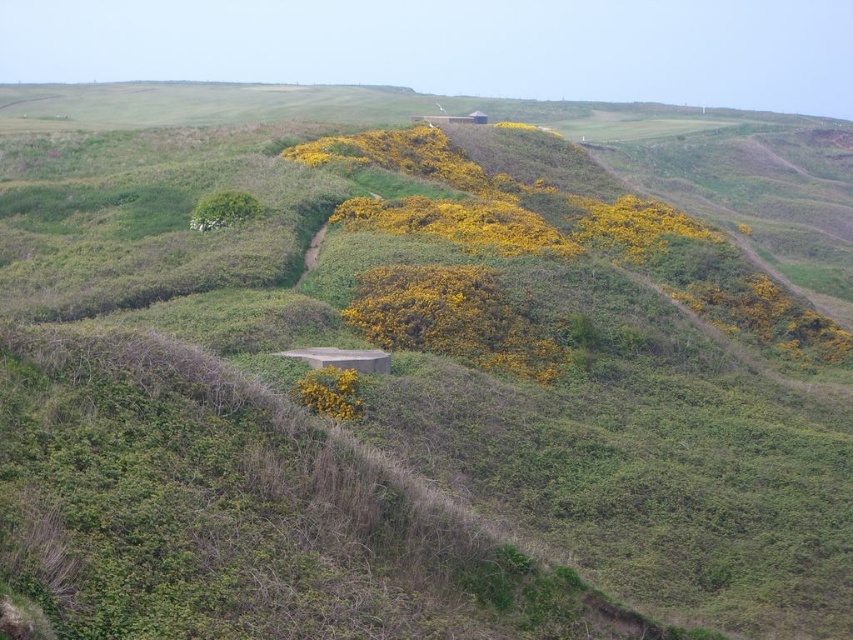
Question: Which of these objects is positioned farthest from the yellow-green foliage at center?

Choices:
 (A) yellow matte flower at center
 (B) yellow matte flowers at center

Answer: (A)

Question: Does yellow-green foliage at center appear on the left side of yellow matte flowers at center?

Choices:
 (A) yes
 (B) no

Answer: (B)

Question: Among these objects, which one is nearest to the camera?

Choices:
 (A) yellow matte flowers at center
 (B) yellow-green foliage at center

Answer: (B)

Question: Does yellow-green foliage at center come behind yellow matte flowers at center?

Choices:
 (A) no
 (B) yes

Answer: (A)

Question: Observing the image, what is the correct spatial positioning of yellow matte flowers at center in reference to yellow matte flower at center?

Choices:
 (A) below
 (B) above

Answer: (B)

Question: Which point is farther to the camera?

Choices:
 (A) (729, 300)
 (B) (509, 208)

Answer: (B)